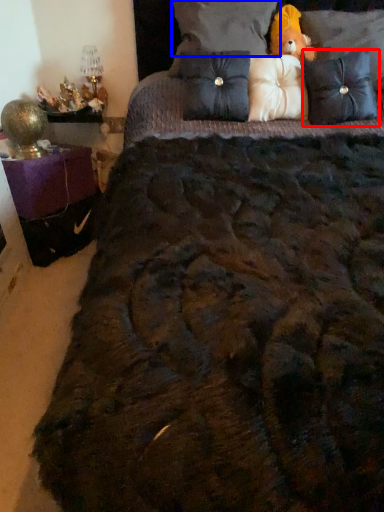
Question: Which point is closer to the camera, pillow (highlighted by a red box) or pillow (highlighted by a blue box)?

Choices:
 (A) pillow
 (B) pillow

Answer: (A)